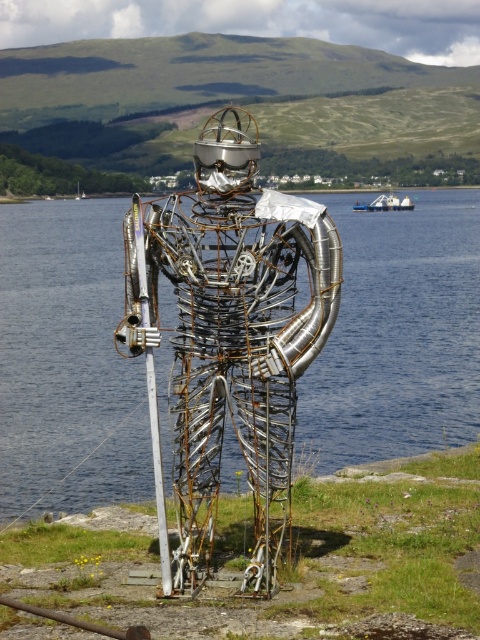
Question: Which point is farther from the camera taking this photo?

Choices:
 (A) (408, 435)
 (B) (136, 275)

Answer: (A)

Question: Does rusty metal sculpture at center appear over silver metallic pole at center?

Choices:
 (A) yes
 (B) no

Answer: (A)

Question: Is blue metallic water at center to the left of silver metallic pole at center from the viewer's perspective?

Choices:
 (A) no
 (B) yes

Answer: (B)

Question: Is blue metallic water at center positioned in front of rusty metal sculpture at center?

Choices:
 (A) no
 (B) yes

Answer: (A)

Question: Estimate the real-world distances between objects in this image. Which object is farther from the blue metallic water at center?

Choices:
 (A) rusty metal sculpture at center
 (B) silver metallic pole at center

Answer: (B)

Question: Which object is positioned closest to the rusty metal sculpture at center?

Choices:
 (A) blue metallic water at center
 (B) silver metallic pole at center

Answer: (B)